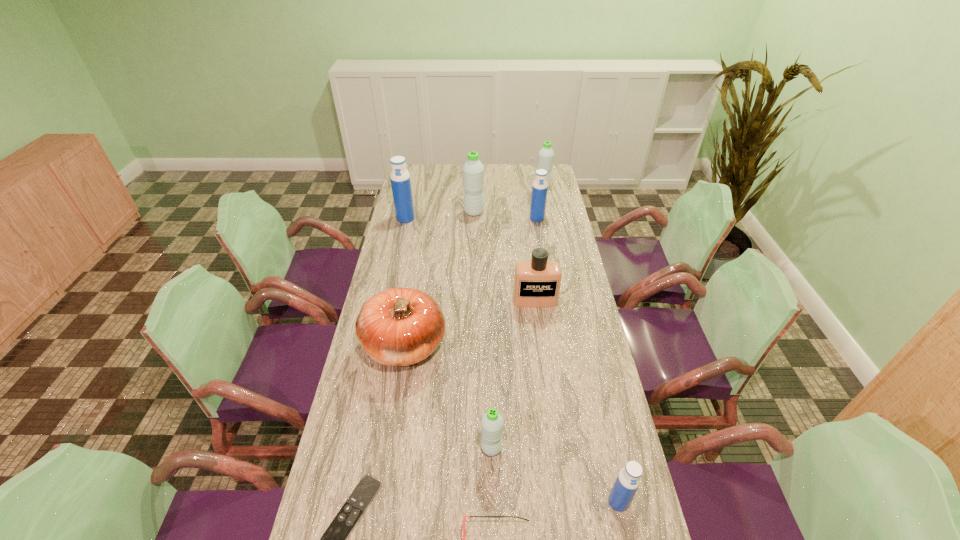
The image size is (960, 540). In order to click on blank area located on the back of the smallest green water bottle in this screenshot , I will do `click(490, 361)`.

I want to click on free space located 0.170m on the left of the rightmost blue water bottle, so click(x=540, y=502).

Where is `object located at the far edge`? The height and width of the screenshot is (540, 960). object located at the far edge is located at coordinates (546, 155).

Identify the location of water bottle at the left edge. This screenshot has width=960, height=540. (400, 178).

Image resolution: width=960 pixels, height=540 pixels. Identify the location of pumpkin that is positioned at the left edge. (400, 326).

What are the coordinates of `perfume that is at the right edge` in the screenshot? It's located at click(537, 282).

You are a GUI agent. You are given a task and a screenshot of the screen. Output one action in this format:
    pyautogui.click(x=<x>, y=<y>)
    Task: Click on the object present at the far right corner
    Image resolution: width=960 pixels, height=540 pixels.
    Given the screenshot: What is the action you would take?
    pyautogui.click(x=546, y=155)

Locate an element on the screen. Image resolution: width=960 pixels, height=540 pixels. free point at the far edge is located at coordinates [x=447, y=185].

The width and height of the screenshot is (960, 540). In order to click on free point at the left edge in this screenshot , I will do `click(429, 188)`.

Locate an element on the screen. This screenshot has width=960, height=540. free spot at the right edge of the desktop is located at coordinates (599, 468).